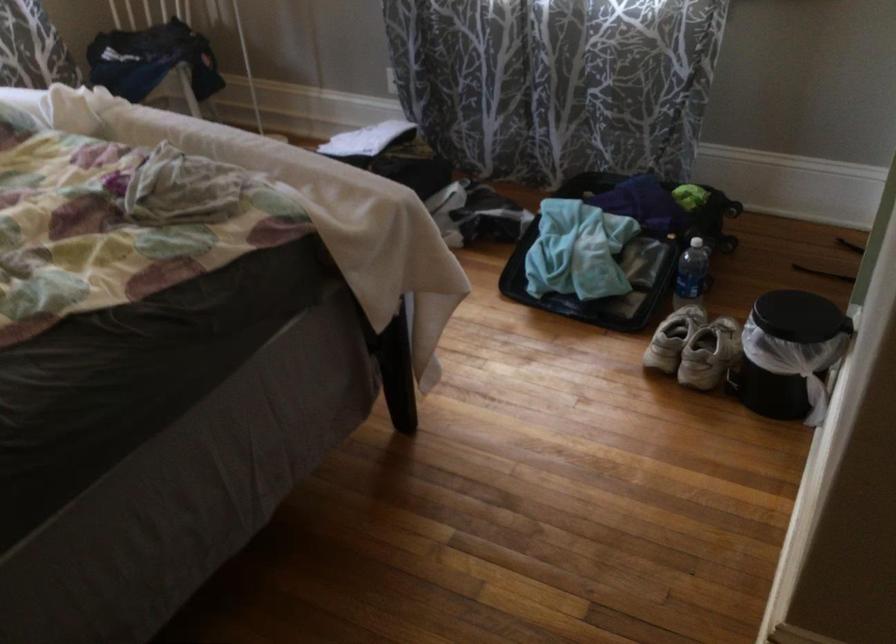
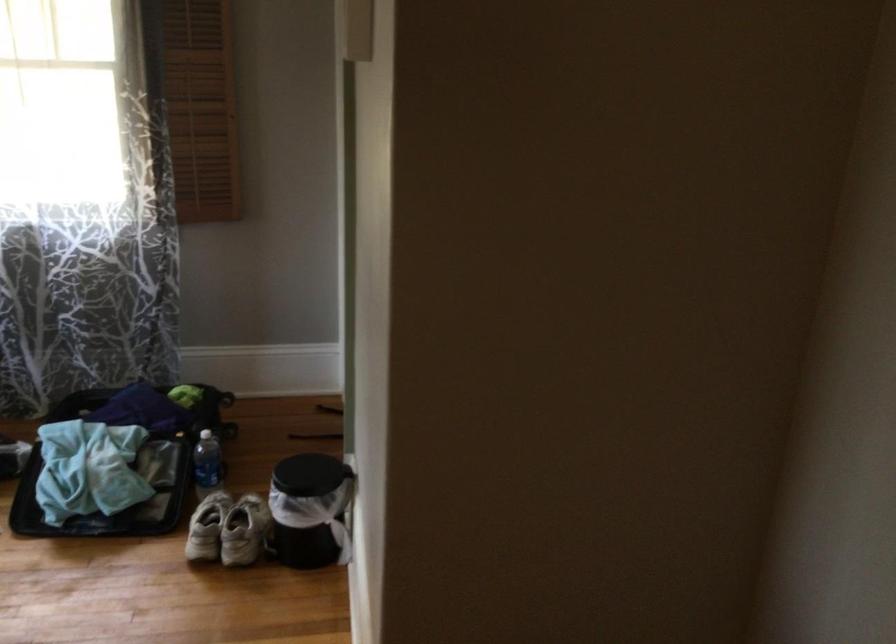
Locate, in the second image, the point that corresponds to [782,352] in the first image.

(309, 509)